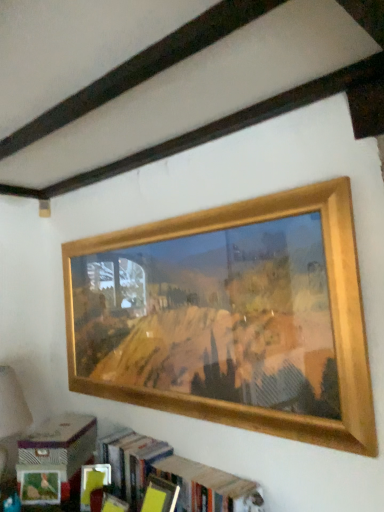
The height and width of the screenshot is (512, 384). What do you see at coordinates (60, 443) in the screenshot? I see `matte cardboard box at lower left` at bounding box center [60, 443].

What do you see at coordinates (242, 330) in the screenshot? I see `wooden picture frame at upper center` at bounding box center [242, 330].

The height and width of the screenshot is (512, 384). I want to click on matte cardboard box at lower left, so click(60, 443).

What's the angular difference between matte cardboard box at lower left and wooden picture frame at upper center's facing directions?

34.9 degrees separate the facing orientations of matte cardboard box at lower left and wooden picture frame at upper center.

Can you confirm if matte cardboard box at lower left is shorter than wooden picture frame at upper center?

Yes.

Does matte cardboard box at lower left come in front of wooden picture frame at upper center?

No, matte cardboard box at lower left is further to the viewer.

Is wooden picture frame at upper center surrounded by matte cardboard box at lower left?

That's incorrect, wooden picture frame at upper center is not inside matte cardboard box at lower left.

Is point (70, 426) positioned after point (211, 502)?

Yes, it is behind point (211, 502).

Is matte cardboard box at lower left looking in the opposite direction of wooden bookshelf at lower center?

No.

From the image's perspective, is matte cardboard box at lower left over wooden bookshelf at lower center?

No.

Considering the relative sizes of matte cardboard box at lower left and wooden bookshelf at lower center in the image provided, is matte cardboard box at lower left wider than wooden bookshelf at lower center?

Yes.

Is wooden picture frame at upper center wider than wooden bookshelf at lower center?

Incorrect, the width of wooden picture frame at upper center does not surpass that of wooden bookshelf at lower center.

Based on the photo, does wooden picture frame at upper center appear on the right side of wooden bookshelf at lower center?

No, wooden picture frame at upper center is not to the right of wooden bookshelf at lower center.

Is wooden picture frame at upper center bigger than wooden bookshelf at lower center?

Correct, wooden picture frame at upper center is larger in size than wooden bookshelf at lower center.

Find the location of a particular element. This screenshot has width=384, height=512. bookcase that is on the right side of wooden picture frame at upper center is located at coordinates (x=174, y=476).

From the image's perspective, which is below, wooden bookshelf at lower center or wooden picture frame at upper center?

wooden bookshelf at lower center.

Considering the sizes of wooden bookshelf at lower center and wooden picture frame at upper center in the image, is wooden bookshelf at lower center wider or thinner than wooden picture frame at upper center?

In the image, wooden bookshelf at lower center appears to be wider than wooden picture frame at upper center.

Would you say wooden bookshelf at lower center is a long distance from wooden picture frame at upper center?

No, wooden bookshelf at lower center is not far from wooden picture frame at upper center.

Are wooden bookshelf at lower center and matte cardboard box at lower left far apart?

They are positioned close to each other.

Who is bigger, wooden bookshelf at lower center or matte cardboard box at lower left?

With larger size is wooden bookshelf at lower center.

What's the angular difference between wooden bookshelf at lower center and matte cardboard box at lower left's facing directions?

There is a 35.2-degree angle between the facing directions of wooden bookshelf at lower center and matte cardboard box at lower left.

Is wooden bookshelf at lower center turned away from matte cardboard box at lower left?

No, wooden bookshelf at lower center is not facing the opposite direction of matte cardboard box at lower left.

Would you consider wooden picture frame at upper center to be distant from matte cardboard box at lower left?

No, wooden picture frame at upper center is not far from matte cardboard box at lower left.

Which object is closer to the camera taking this photo, wooden picture frame at upper center or matte cardboard box at lower left?

wooden picture frame at upper center is in front.

From the image's perspective, would you say wooden picture frame at upper center is positioned over matte cardboard box at lower left?

Correct, wooden picture frame at upper center appears higher than matte cardboard box at lower left in the image.

Locate an element on the screen. Image resolution: width=384 pixels, height=512 pixels. picture frame above the matte cardboard box at lower left (from the image's perspective) is located at coordinates (242, 330).

Identify the location of paperback book located below the wooden bookshelf at lower center (from the image's perspective). (60, 443).

When comparing their distances from wooden picture frame at upper center, does matte cardboard box at lower left or wooden bookshelf at lower center seem further?

The object further to wooden picture frame at upper center is matte cardboard box at lower left.

When comparing their distances from wooden bookshelf at lower center, does matte cardboard box at lower left or wooden picture frame at upper center seem closer?

matte cardboard box at lower left is closer to wooden bookshelf at lower center.

Considering their positions, is wooden bookshelf at lower center positioned further to matte cardboard box at lower left than wooden picture frame at upper center?

wooden picture frame at upper center lies further to matte cardboard box at lower left than the other object.

Estimate the real-world distances between objects in this image. Which object is closer to wooden picture frame at upper center, wooden bookshelf at lower center or matte cardboard box at lower left?

wooden bookshelf at lower center is positioned closer to the anchor wooden picture frame at upper center.

Estimate the real-world distances between objects in this image. Which object is further from wooden bookshelf at lower center, wooden picture frame at upper center or matte cardboard box at lower left?

wooden picture frame at upper center lies further to wooden bookshelf at lower center than the other object.

Estimate the real-world distances between objects in this image. Which object is closer to matte cardboard box at lower left, wooden picture frame at upper center or wooden bookshelf at lower center?

Based on the image, wooden bookshelf at lower center appears to be nearer to matte cardboard box at lower left.

I want to click on bookcase between wooden picture frame at upper center and matte cardboard box at lower left in the up-down direction, so click(174, 476).